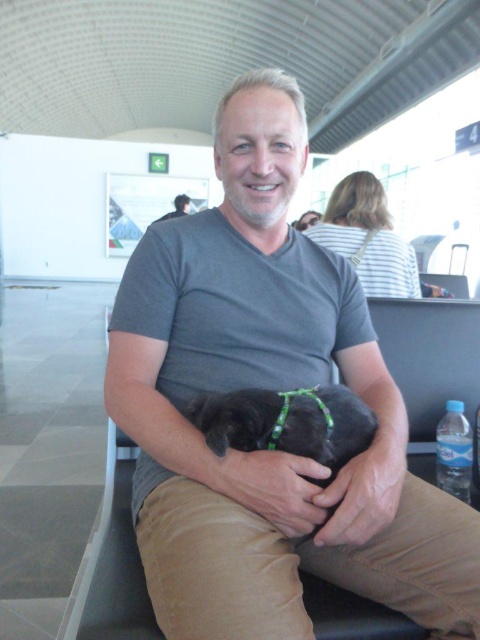
This screenshot has width=480, height=640. What do you see at coordinates (271, 387) in the screenshot? I see `gray cotton shirt at center` at bounding box center [271, 387].

Does gray cotton shirt at center have a smaller size compared to matte gray shirt at center?

No.

Between point (298, 339) and point (176, 205), which one is positioned in front?

Positioned in front is point (298, 339).

Locate an element on the screen. This screenshot has width=480, height=640. gray cotton shirt at center is located at coordinates (271, 387).

Consider the image. Measure the distance between gray cotton shirt at center and camera.

24.41 inches

From the picture: Is gray cotton shirt at center in front of black matte dog at center?

That is True.

Is point (324, 566) more distant than point (359, 432)?

Yes.

The height and width of the screenshot is (640, 480). I want to click on gray cotton shirt at center, so click(x=271, y=387).

Is black matte dog at center behind matte gray shirt at center?

No, black matte dog at center is in front of matte gray shirt at center.

Does black matte dog at center have a greater width compared to matte gray shirt at center?

No.

Which is behind, point (240, 416) or point (181, 211)?

Point (181, 211)

Identify the location of black matte dog at center. (288, 422).